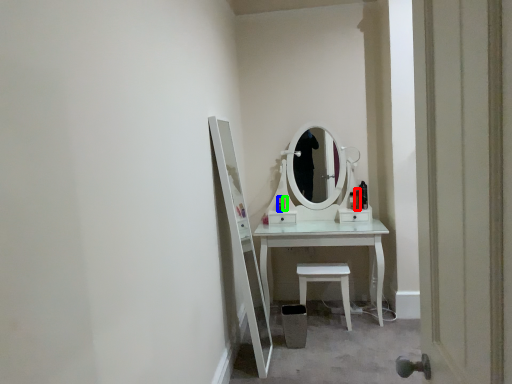
Question: Estimate the real-world distances between objects in this image. Which object is closer to toiletry (highlighted by a red box), toiletry (highlighted by a blue box) or toiletry (highlighted by a green box)?

Choices:
 (A) toiletry
 (B) toiletry

Answer: (B)